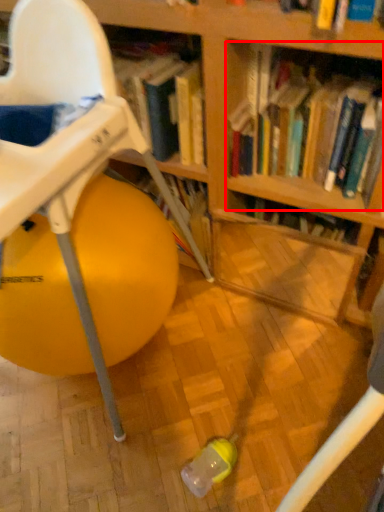
Question: From the image's perspective, considering the relative positions of book (annotated by the red box) and chair in the image provided, where is book (annotated by the red box) located with respect to the staircase?

Choices:
 (A) below
 (B) above

Answer: (B)